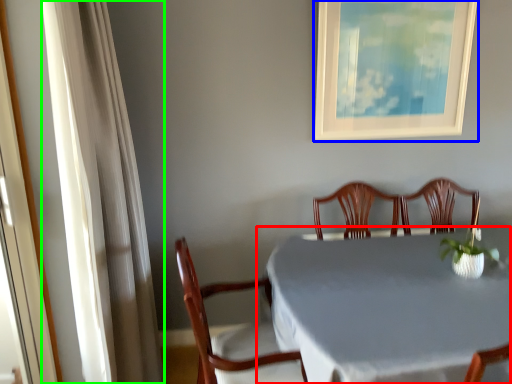
Question: Estimate the real-world distances between objects in this image. Which object is farther from table (highlighted by a red box), picture frame (highlighted by a blue box) or curtain (highlighted by a green box)?

Choices:
 (A) picture frame
 (B) curtain

Answer: (A)